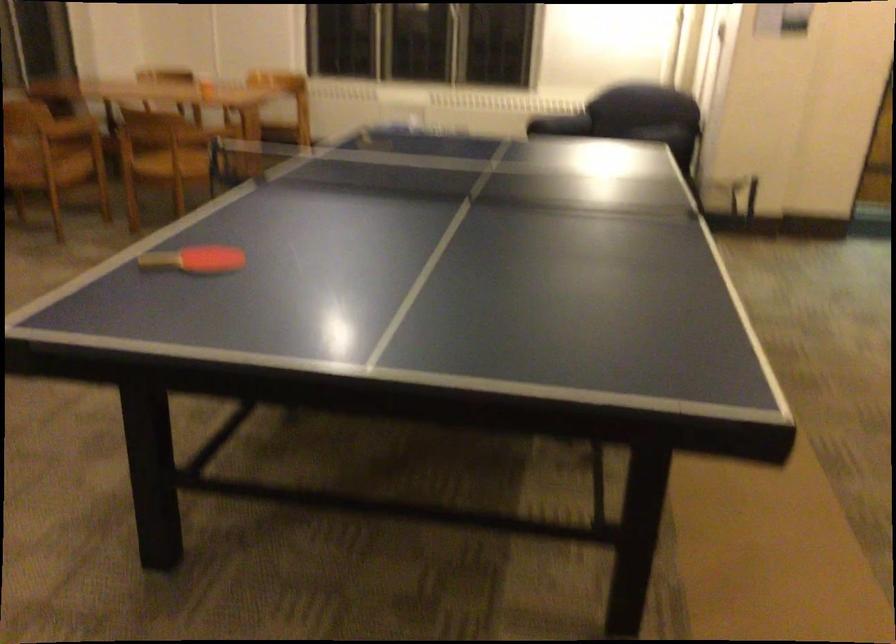
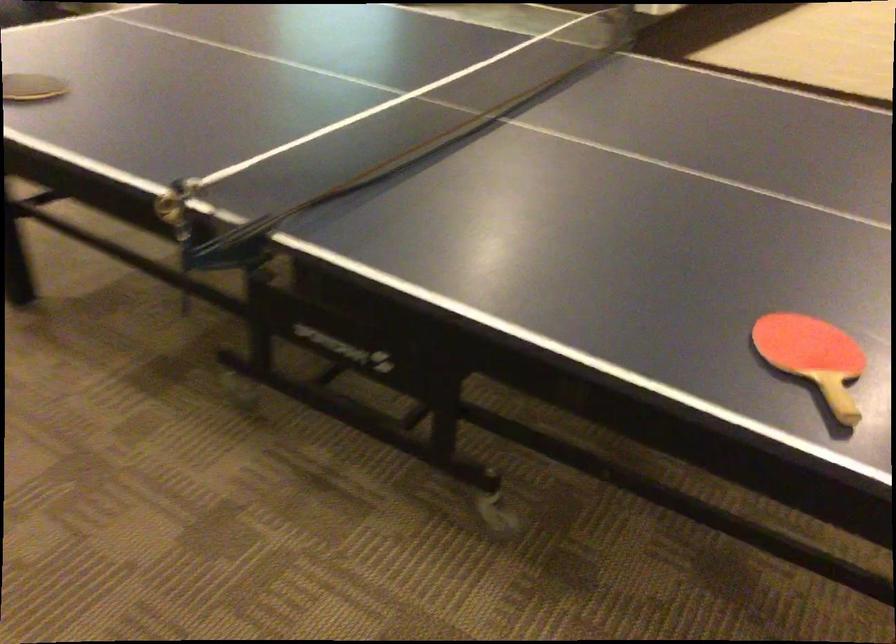
The point at (153,257) is marked in the first image. Where is the corresponding point in the second image?

(813, 357)